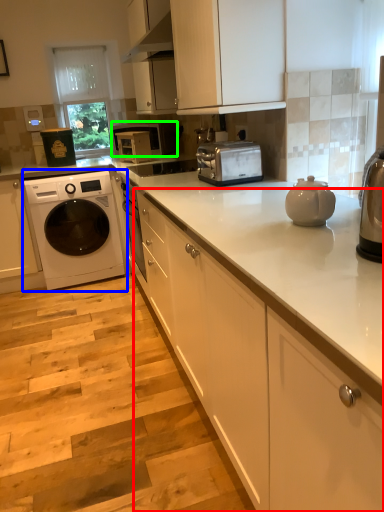
Question: Which object is positioned closest to cabinetry (highlighted by a red box)? Select from washing machine (highlighted by a blue box) and microwave oven (highlighted by a green box).

Choices:
 (A) washing machine
 (B) microwave oven

Answer: (A)